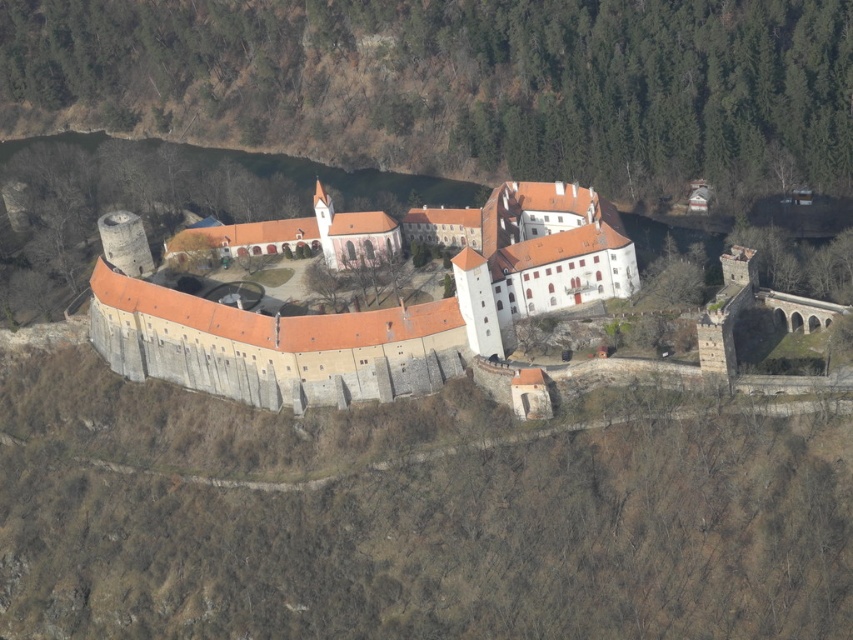
Is brown stone castle at center below white stone monastery at center?

Actually, brown stone castle at center is above white stone monastery at center.

Between brown stone castle at center and white stone monastery at center, which one has more height?

With more height is brown stone castle at center.

You are a GUI agent. You are given a task and a screenshot of the screen. Output one action in this format:
    pyautogui.click(x=<x>, y=<y>)
    Task: Click on the brown stone castle at center
    
    Given the screenshot: What is the action you would take?
    pyautogui.click(x=461, y=83)